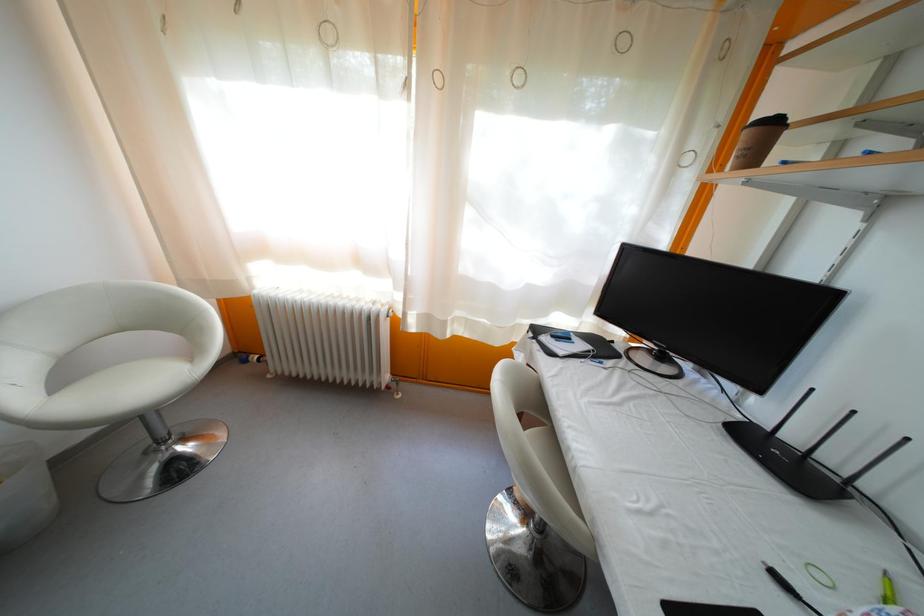
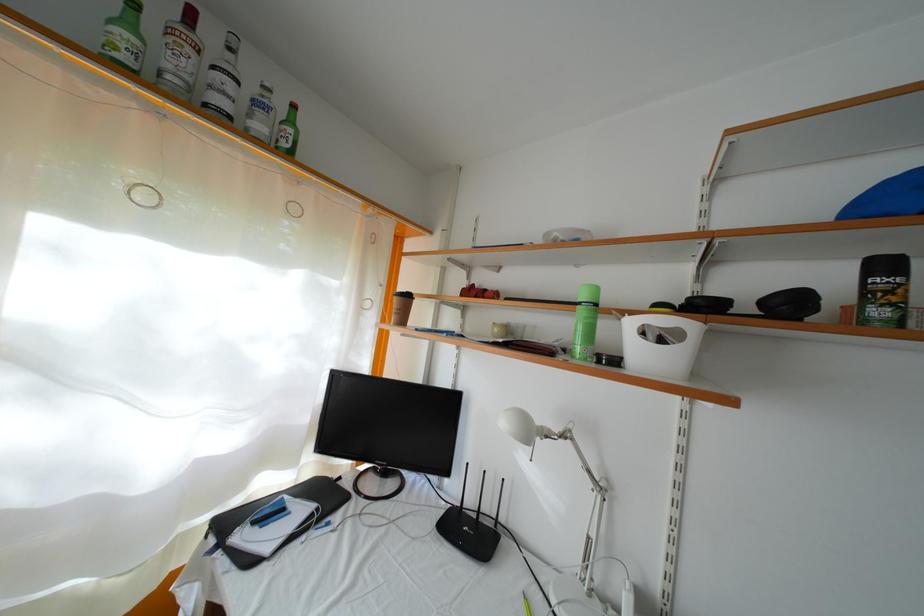
The point at (751, 139) is marked in the first image. Where is the corresponding point in the second image?

(400, 305)